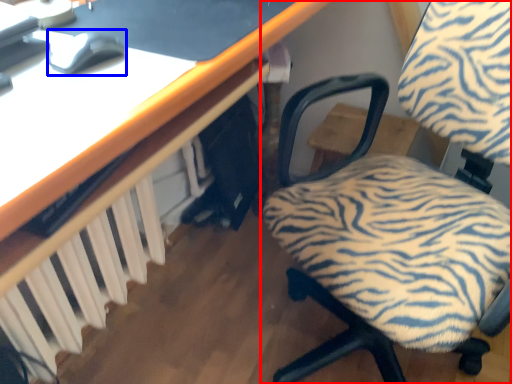
Question: Which point is further to the camera, chair (highlighted by a red box) or mouse (highlighted by a blue box)?

Choices:
 (A) chair
 (B) mouse

Answer: (B)